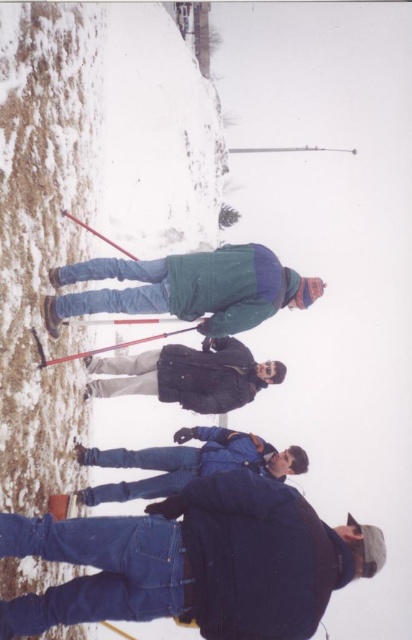
Question: From the image, what is the correct spatial relationship of dark gray jacket at center in relation to blue fleece jacket at lower center?

Choices:
 (A) below
 (B) above

Answer: (B)

Question: Does green matte jacket at center appear over dark gray jacket at center?

Choices:
 (A) yes
 (B) no

Answer: (A)

Question: Estimate the real-world distances between objects in this image. Which object is closer to the blue fleece jacket at lower center?

Choices:
 (A) red plastic ski pole at center
 (B) green matte jacket at center

Answer: (A)

Question: Is blue fleece jacket at lower center positioned at the back of red plastic ski pole at center?

Choices:
 (A) no
 (B) yes

Answer: (B)

Question: Among these points, which one is nearest to the camera?

Choices:
 (A) (95, 381)
 (B) (46, 364)
 (C) (196, 275)

Answer: (B)

Question: Which object is farther from the camera taking this photo?

Choices:
 (A) denim jacket at lower right
 (B) red plastic ski pole at center

Answer: (B)